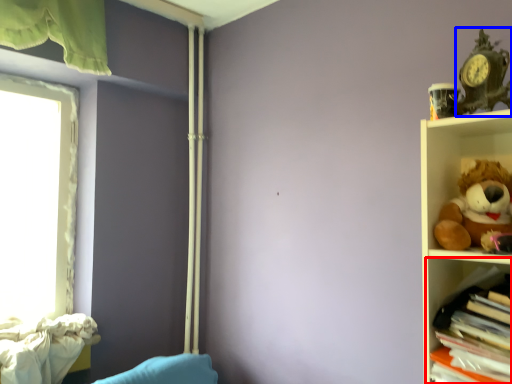
Question: Which point is closer to the camera, shelf (highlighted by a red box) or toy (highlighted by a blue box)?

Choices:
 (A) shelf
 (B) toy

Answer: (A)